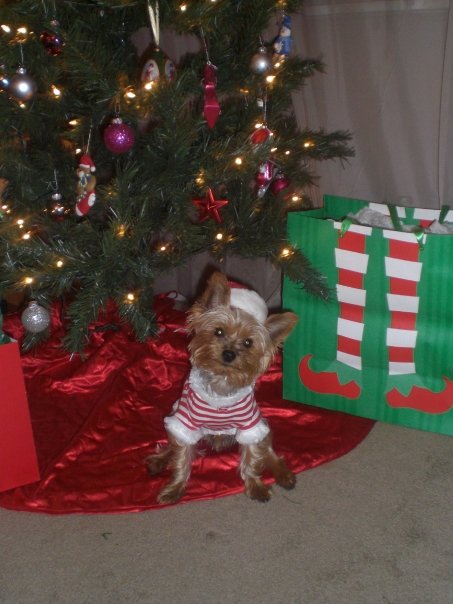
Where is `carpet`? The height and width of the screenshot is (604, 453). carpet is located at coordinates (376, 532).